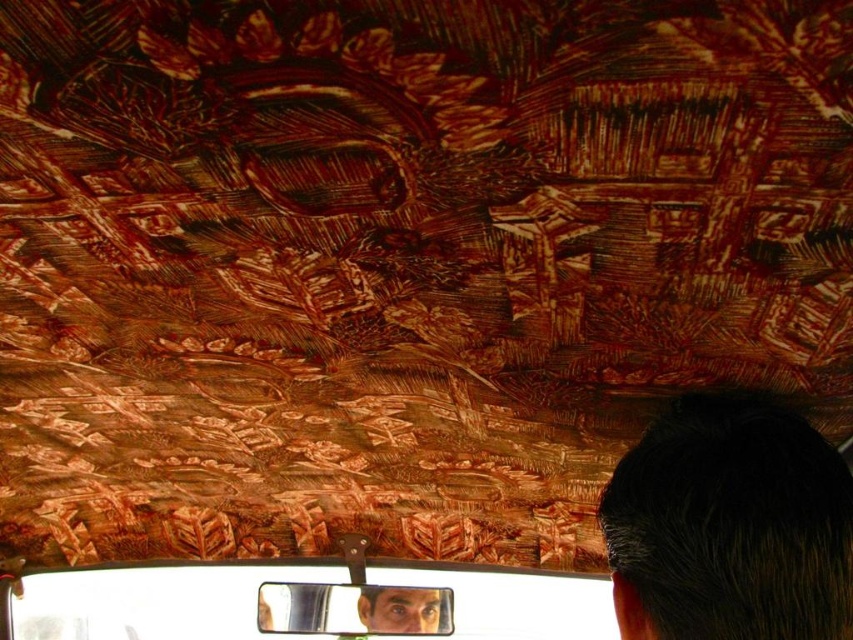
Which is below, dark brown hair at upper right or metallic reflective mirror at center?

metallic reflective mirror at center is lower down.

Can you confirm if dark brown hair at upper right is positioned to the left of metallic reflective mirror at center?

No, dark brown hair at upper right is not to the left of metallic reflective mirror at center.

This screenshot has width=853, height=640. What are the coordinates of `dark brown hair at upper right` in the screenshot? It's located at (729, 525).

The image size is (853, 640). I want to click on dark brown hair at upper right, so click(x=729, y=525).